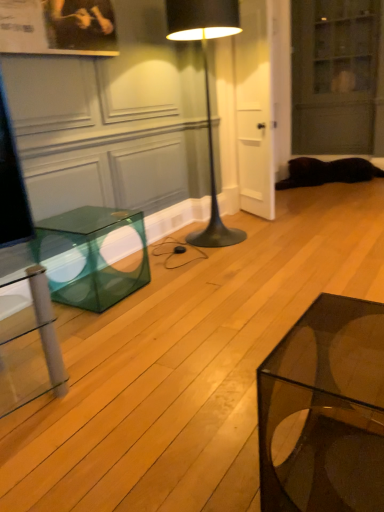
Image resolution: width=384 pixels, height=512 pixels. In order to click on free space behind transparent glass coffee table at lower right in this screenshot , I will do `click(269, 408)`.